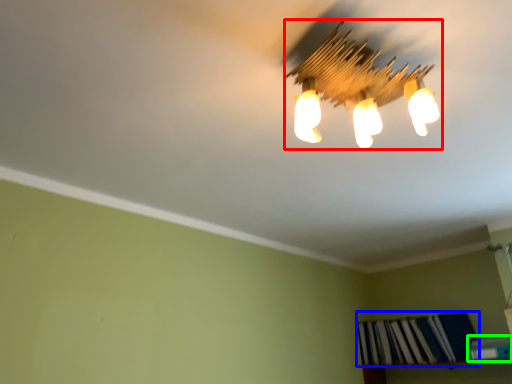
Question: Which object is positioned closest to lamp (highlighted by a red box)? Select from book (highlighted by a blue box) and book (highlighted by a green box).

Choices:
 (A) book
 (B) book

Answer: (B)